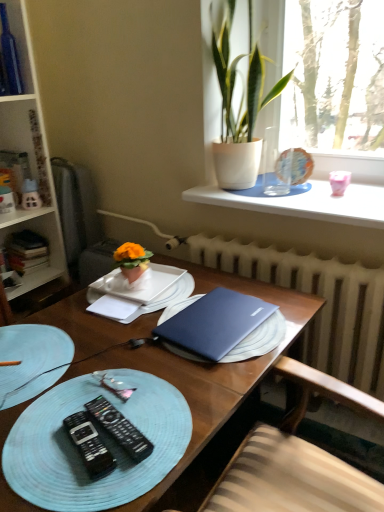
Locate an element on the screen. The width and height of the screenshot is (384, 512). vacant area in front of green leafy plant at upper right, arranged as the 1th houseplant when viewed from the top is located at coordinates (300, 202).